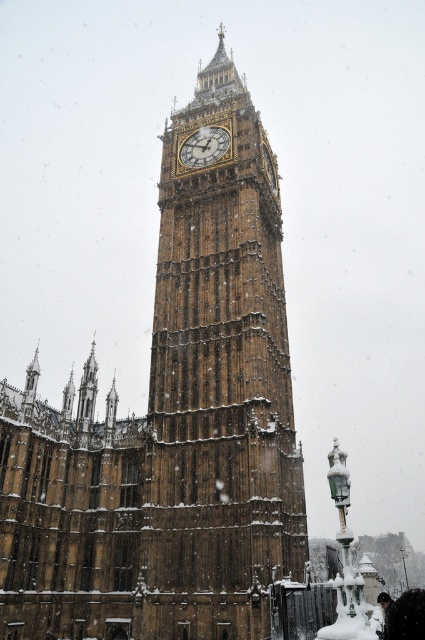
Question: Which of the following is the farthest from the observer?

Choices:
 (A) gold textured clock at center
 (B) brown stone clock tower at center

Answer: (A)

Question: Which of the following is the farthest from the observer?

Choices:
 (A) (255, 420)
 (B) (212, 129)

Answer: (B)

Question: Does brown stone clock tower at center appear over gold textured clock at center?

Choices:
 (A) yes
 (B) no

Answer: (A)

Question: Is brown stone clock tower at center further to camera compared to gold textured clock at center?

Choices:
 (A) no
 (B) yes

Answer: (A)

Question: Does brown stone clock tower at center come in front of gold textured clock at center?

Choices:
 (A) no
 (B) yes

Answer: (B)